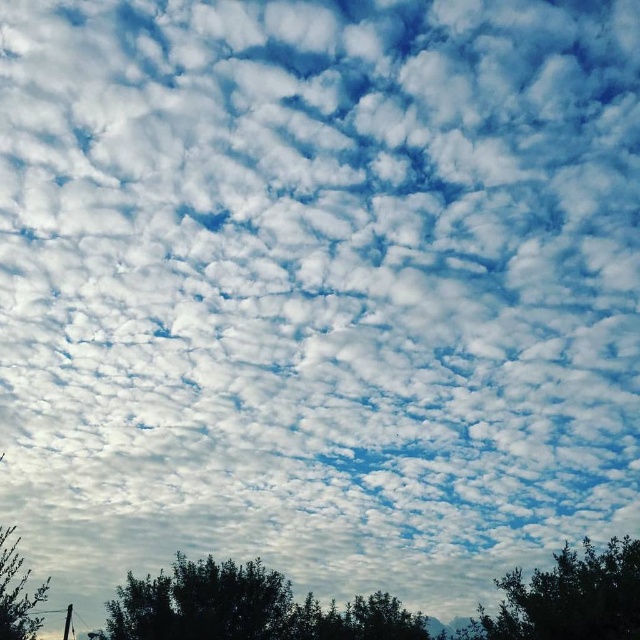
You are standing in a field looking at the two green leafy trees. Which tree is closer to you, the green leafy tree at lower right or the green leafy tree at lower left?

The green leafy tree at lower right is closer to you because it is further to the viewer than the green leafy tree at lower left.

You are standing in a field looking up at the sky. There is a point marked at coordinates (244, 608). What object is located at that point?

The point at coordinates (244, 608) marks the green leafy tree at lower center.